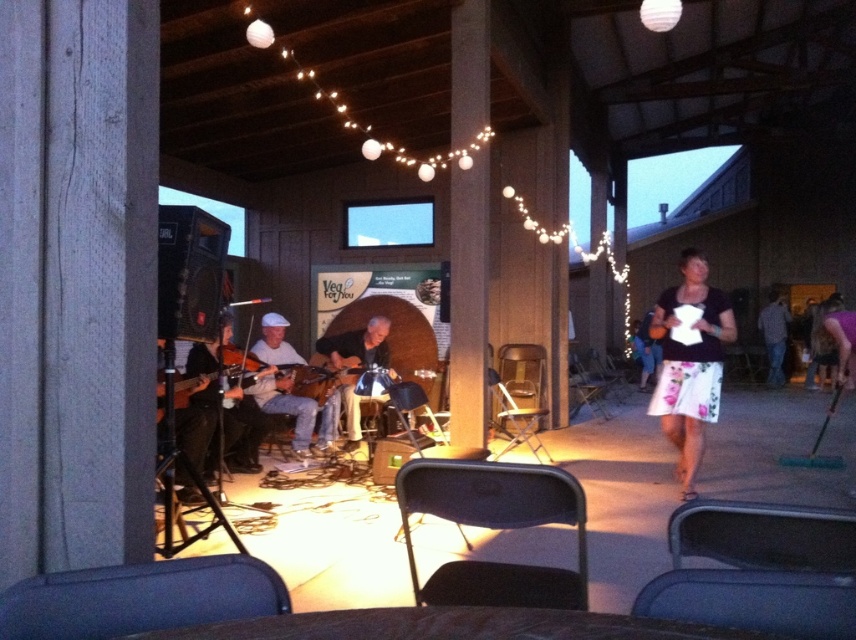
Question: Based on their relative distances, which object is farther from the matte brown guitar at center?

Choices:
 (A) floral skirt at right
 (B) wooden acoustic guitar at center

Answer: (A)

Question: Can you confirm if floral skirt at right is bigger than matte brown guitar at center?

Choices:
 (A) yes
 (B) no

Answer: (A)

Question: Is matte brown guitar at center behind wooden acoustic guitar at center?

Choices:
 (A) no
 (B) yes

Answer: (A)

Question: Is floral skirt at right further to the viewer compared to matte brown guitar at center?

Choices:
 (A) yes
 (B) no

Answer: (B)

Question: Which object is closer to the camera taking this photo?

Choices:
 (A) matte brown guitar at center
 (B) wooden acoustic guitar at center

Answer: (A)

Question: Which point is closer to the camera taking this photo?

Choices:
 (A) (278, 321)
 (B) (717, 397)
 (C) (360, 365)

Answer: (B)